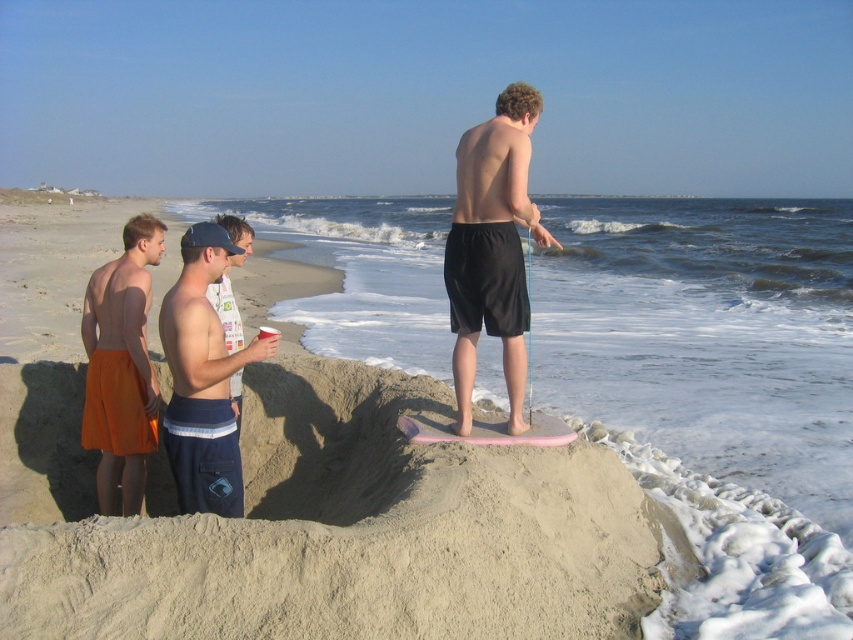
Describe the element at coordinates (715, 390) in the screenshot. I see `beige sandcastle at center` at that location.

In the scene shown: Does beige sandcastle at center have a smaller size compared to blue denim shorts at center?

Actually, beige sandcastle at center might be larger than blue denim shorts at center.

I want to click on beige sandcastle at center, so click(715, 390).

Is point (784, 312) positioned behind point (132, 324)?

Yes, it is behind point (132, 324).

Can you confirm if beige sandcastle at center is bigger than orange fabric shorts at left?

Correct, beige sandcastle at center is larger in size than orange fabric shorts at left.

Is point (339, 342) closer to camera compared to point (128, 330)?

No, it is behind (128, 330).

At what (x,y) coordinates should I click in order to perform the action: click on beige sandcastle at center. Please return your answer as a coordinate pair (x, y). Image resolution: width=853 pixels, height=640 pixels. Looking at the image, I should click on 715,390.

Between beige sandcastle at center and white printed t-shirt at center, which one appears on the right side from the viewer's perspective?

beige sandcastle at center is more to the right.

At what (x,y) coordinates should I click in order to perform the action: click on beige sandcastle at center. Please return your answer as a coordinate pair (x, y). The width and height of the screenshot is (853, 640). Looking at the image, I should click on (715, 390).

Describe the element at coordinates (715, 390) in the screenshot. The width and height of the screenshot is (853, 640). I see `beige sandcastle at center` at that location.

Identify the location of beige sandcastle at center. The width and height of the screenshot is (853, 640). (715, 390).